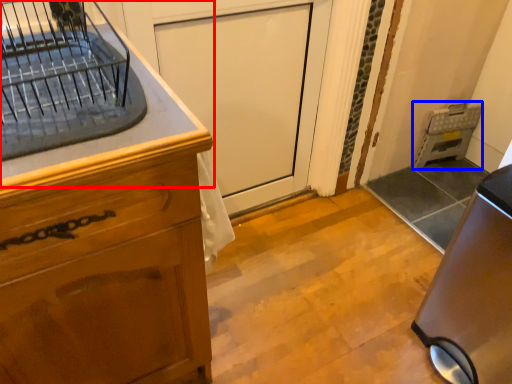
Question: Which object is closer to the camera taking this photo, countertop (highlighted by a red box) or appliance (highlighted by a blue box)?

Choices:
 (A) countertop
 (B) appliance

Answer: (A)